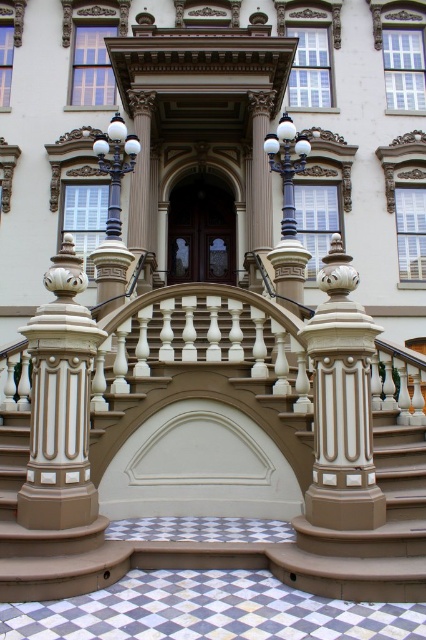
Does beige glossy column at center appear over matte beige column at center?

Yes.

Is beige glossy column at center bigger than matte beige column at center?

No, beige glossy column at center is not bigger than matte beige column at center.

Locate an element on the screen. The height and width of the screenshot is (640, 426). beige glossy column at center is located at coordinates (60, 403).

Between point (402, 467) and point (169, 264), which one is positioned in front?

Point (402, 467)

Find the location of a particular element. The height and width of the screenshot is (640, 426). matte beige staircase at center is located at coordinates click(x=247, y=417).

Between matte beige staircase at center and beige glossy column at center, which one is positioned lower?

matte beige staircase at center is below.

This screenshot has height=640, width=426. What do you see at coordinates (247, 417) in the screenshot?
I see `matte beige staircase at center` at bounding box center [247, 417].

Which is in front, point (373, 369) or point (60, 406)?

Point (60, 406) is in front.

I want to click on matte beige staircase at center, so click(x=247, y=417).